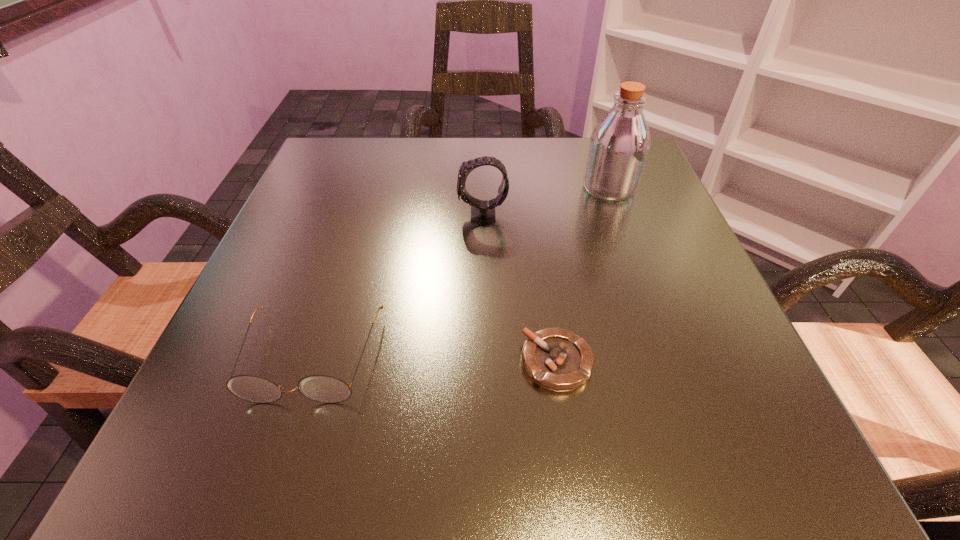
This screenshot has height=540, width=960. In order to click on blank space that satisfies the following two spatial constraints: 1. on the back side of the ashtray; 2. on the right side of the bottle in this screenshot , I will do `click(532, 188)`.

Identify the location of vacant space that satisfies the following two spatial constraints: 1. on the face of the watch; 2. on the temples of the spectacles. click(x=483, y=358).

The width and height of the screenshot is (960, 540). Identify the location of vacant region that satisfies the following two spatial constraints: 1. on the face of the second tallest object; 2. on the temples of the second shortest object. (483, 358).